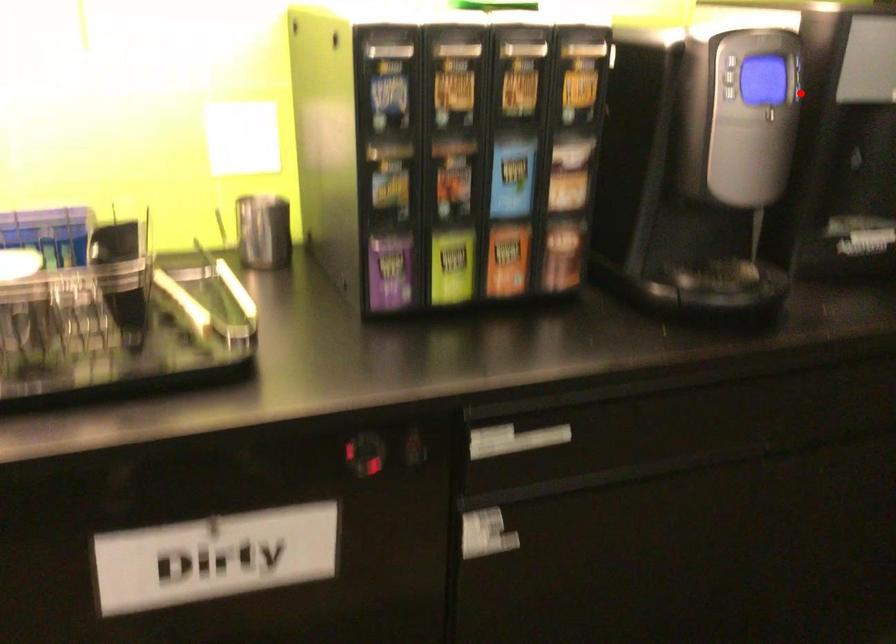
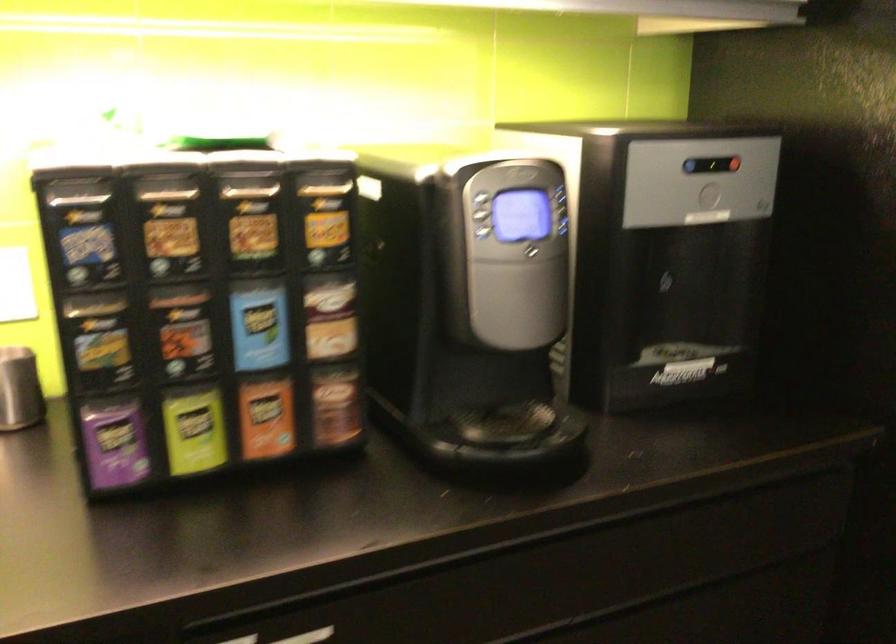
Where in the second image is the point corresponding to the highlighted location from the first image?

(565, 227)